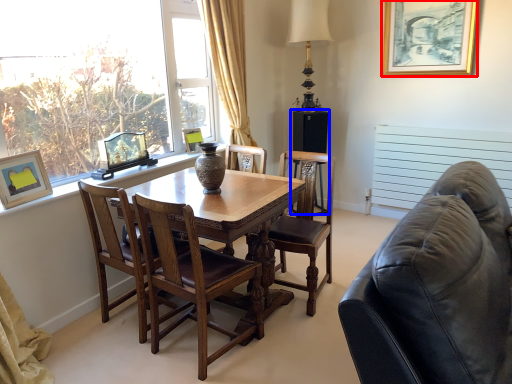
Question: Which point is closer to the camera, picture frame (highlighted by a red box) or speaker (highlighted by a blue box)?

Choices:
 (A) picture frame
 (B) speaker

Answer: (A)